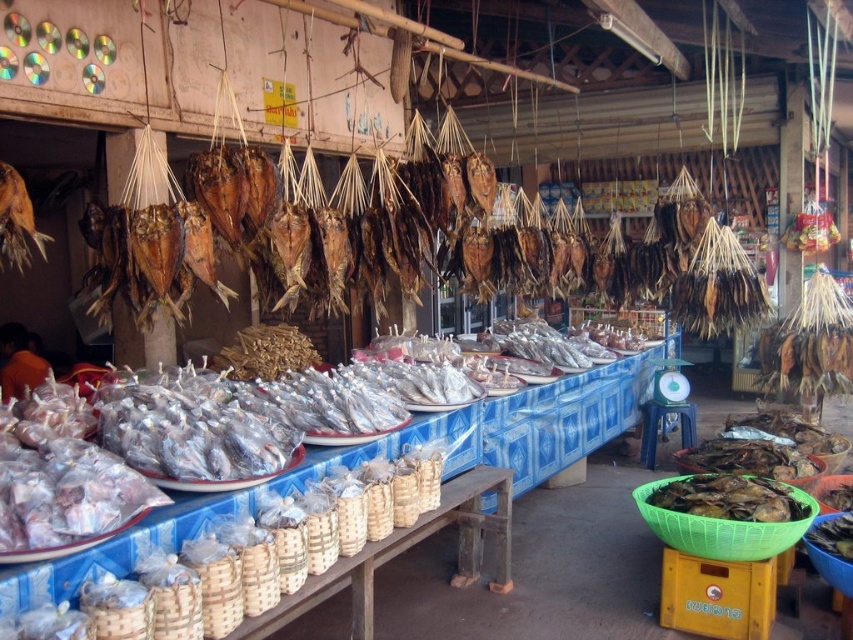
Who is shorter, brown dried fish at center or brown matte dried fish at lower right?

brown matte dried fish at lower right is shorter.

Locate an element on the screen. The image size is (853, 640). brown dried fish at center is located at coordinates (527, 256).

Who is more forward, (671, 182) or (718, 477)?

Point (718, 477)

At what (x,y) coordinates should I click in order to perform the action: click on brown dried fish at center. Please return your answer as a coordinate pair (x, y). This screenshot has height=640, width=853. Looking at the image, I should click on (527, 256).

Looking at this image, is blue woven baskets at center to the left of green woven basket at lower right from the viewer's perspective?

Indeed, blue woven baskets at center is positioned on the left side of green woven basket at lower right.

Does point (187, 520) come closer to viewer compared to point (846, 532)?

Yes.

Locate an element on the screen. The height and width of the screenshot is (640, 853). blue woven baskets at center is located at coordinates (508, 422).

Between brown dried fish at center and green woven basket at lower right, which one has less height?

green woven basket at lower right

The height and width of the screenshot is (640, 853). What do you see at coordinates (527, 256) in the screenshot?
I see `brown dried fish at center` at bounding box center [527, 256].

What do you see at coordinates (527, 256) in the screenshot? I see `brown dried fish at center` at bounding box center [527, 256].

At what (x,y) coordinates should I click in order to perform the action: click on brown dried fish at center. Please return your answer as a coordinate pair (x, y). Looking at the image, I should click on (527, 256).